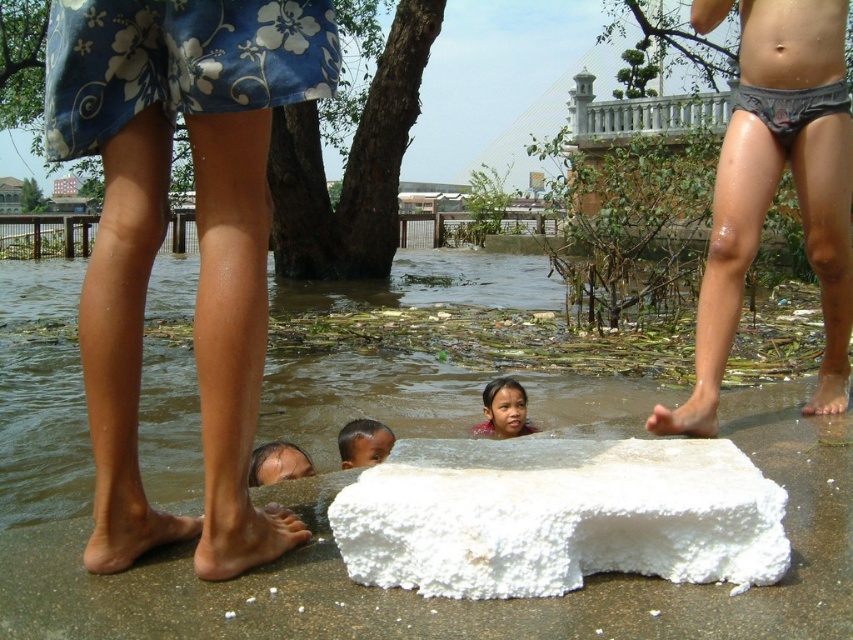
Is point (210, 339) in front of point (746, 202)?

Yes, it is in front of point (746, 202).

How distant is blue floral fabric shorts at lower left from gray fabric shorts at right?

They are 3.00 meters apart.

Between point (221, 230) and point (788, 24), which one is positioned behind?

The point (788, 24) is behind.

I want to click on blue floral fabric shorts at lower left, so click(195, 218).

Between point (258, 554) and point (485, 394), which one is positioned in front?

Point (258, 554)

The height and width of the screenshot is (640, 853). Identify the location of dry skin foot at lower left. (242, 538).

Which is above, blue floral fabric shorts at lower left or white foam block at lower right?

blue floral fabric shorts at lower left

Does point (126, 241) come behind point (838, 394)?

No, (126, 241) is in front of (838, 394).

This screenshot has height=640, width=853. Identify the location of blue floral fabric shorts at lower left. (195, 218).